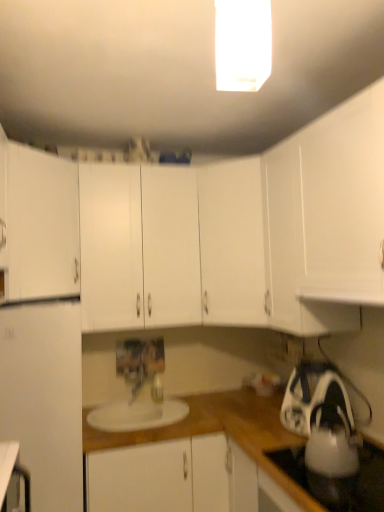
Question: Should I look upward or downward to see white glossy tea pot at lower right?

Choices:
 (A) up
 (B) down

Answer: (B)

Question: From the image's perspective, is white glossy gas stove at lower right above white matte cabinet at left, which appears as the first cabinetry when viewed from the top?

Choices:
 (A) yes
 (B) no

Answer: (B)

Question: Is white glossy gas stove at lower right thinner than white matte cabinet at left, placed as the fourth cabinetry when sorted from bottom to top?

Choices:
 (A) no
 (B) yes

Answer: (A)

Question: Is white glossy gas stove at lower right not within white matte cabinet at left, placed as the fourth cabinetry when sorted from bottom to top?

Choices:
 (A) yes
 (B) no

Answer: (A)

Question: Does white glossy gas stove at lower right touch white matte cabinet at left, which appears as the first cabinetry when viewed from the top?

Choices:
 (A) no
 (B) yes

Answer: (A)

Question: Does white glossy gas stove at lower right have a lesser height compared to white matte cabinet at left, placed as the fourth cabinetry when sorted from bottom to top?

Choices:
 (A) yes
 (B) no

Answer: (A)

Question: Is white glossy gas stove at lower right aimed at white matte cabinet at left, placed as the fourth cabinetry when sorted from bottom to top?

Choices:
 (A) yes
 (B) no

Answer: (B)

Question: Could you tell me if white glossy rectangular light fixture at upper center is turned towards white glossy tea pot at lower right?

Choices:
 (A) yes
 (B) no

Answer: (B)

Question: Does white glossy rectangular light fixture at upper center appear on the left side of white glossy tea pot at lower right?

Choices:
 (A) no
 (B) yes

Answer: (B)

Question: Is white glossy rectangular light fixture at upper center next to white glossy tea pot at lower right?

Choices:
 (A) yes
 (B) no

Answer: (B)

Question: From the image's perspective, is white glossy rectangular light fixture at upper center located above white glossy tea pot at lower right?

Choices:
 (A) no
 (B) yes

Answer: (B)

Question: Does white glossy rectangular light fixture at upper center have a greater width compared to white glossy tea pot at lower right?

Choices:
 (A) yes
 (B) no

Answer: (B)

Question: From a real-world perspective, is white glossy rectangular light fixture at upper center below white glossy tea pot at lower right?

Choices:
 (A) no
 (B) yes

Answer: (A)

Question: From a real-world perspective, is white matte cabinet at center, the second cabinetry positioned from the bottom, over white glossy rectangular light fixture at upper center?

Choices:
 (A) yes
 (B) no

Answer: (B)